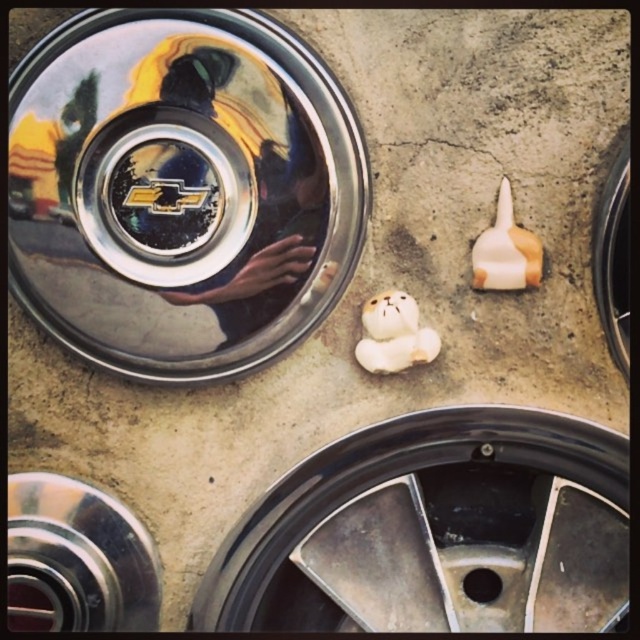
Question: Which object appears closest to the camera in this image?

Choices:
 (A) black rubber tire at right
 (B) tan matte bear at center
 (C) chrome metallic hubcap at upper left

Answer: (C)

Question: Is black rubber tire at right closer to camera compared to white glossy bear at center?

Choices:
 (A) yes
 (B) no

Answer: (A)

Question: Which point is farther to the camera?

Choices:
 (A) (257, 28)
 (B) (394, 298)
 (C) (499, 230)

Answer: (B)

Question: Can you confirm if chrome metallic hubcap at upper left is thinner than tan matte bear at center?

Choices:
 (A) yes
 (B) no

Answer: (B)

Question: Can you confirm if chrome metallic hubcap at upper left is bigger than white glossy bear at center?

Choices:
 (A) no
 (B) yes

Answer: (B)

Question: Estimate the real-world distances between objects in this image. Which object is closer to the tan matte bear at center?

Choices:
 (A) metallic silver wheel at bottom center
 (B) chrome metallic hubcap at upper left
 (C) white glossy bear at center
 (D) black rubber tire at right

Answer: (D)